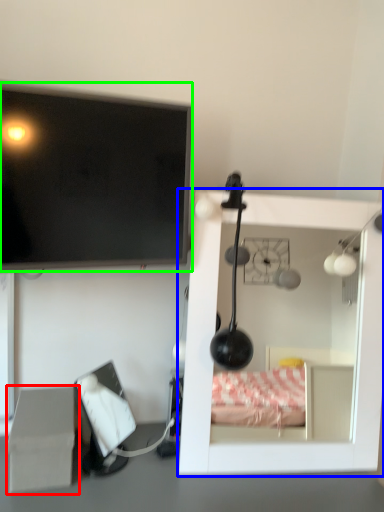
Question: Based on their relative distances, which object is farther from cardboard box (highlighted by a red box)? Choose from furniture (highlighted by a blue box) and television (highlighted by a green box).

Choices:
 (A) furniture
 (B) television

Answer: (A)